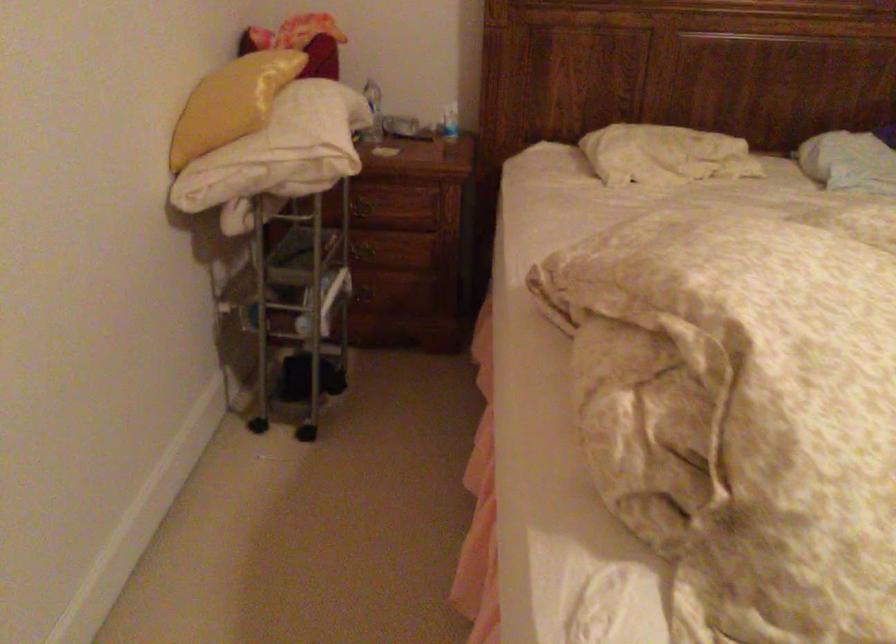
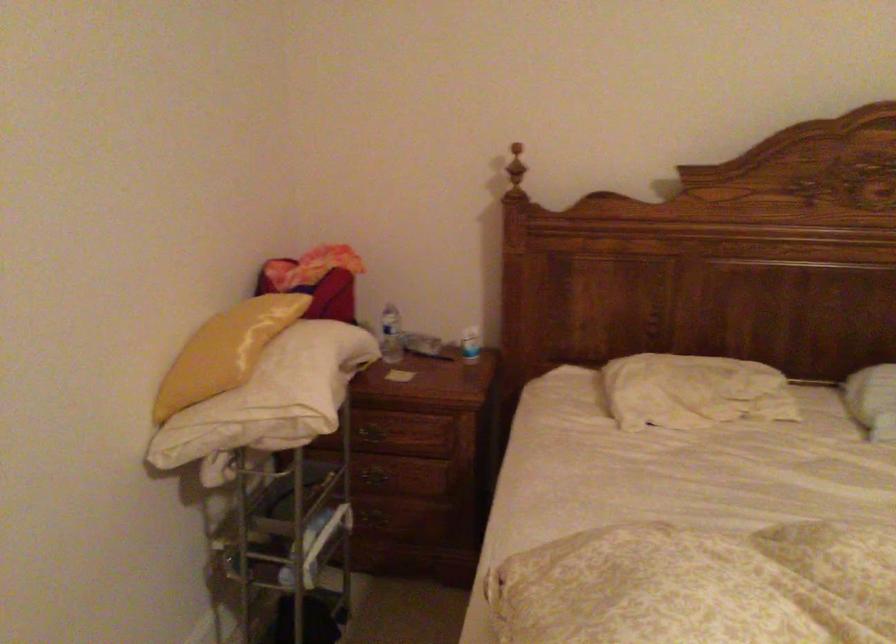
In the scene shown: The images are taken continuously from a first-person perspective. In which direction are you moving?

The movement direction of the cameraman is right, forward.